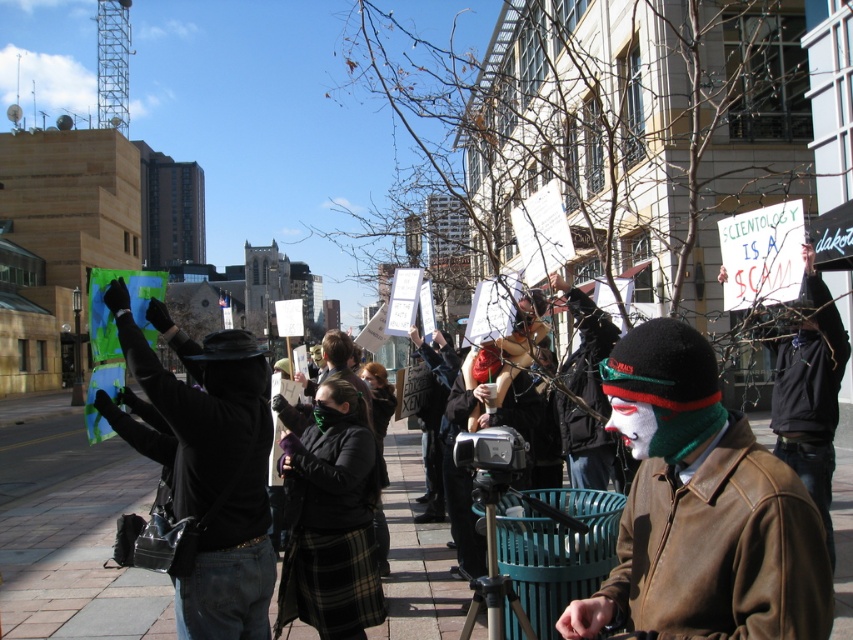
Based on the photo, you are a photographer trying to capture a clear shot of both the brown leather jacket at center and the black leather jacket at center in the protest scene. Which jacket should you focus on first to ensure it doesn t get blocked by the other?

The brown leather jacket at center has a lesser height compared to the black leather jacket at center. Therefore, you should focus on the brown leather jacket at center first to prevent it from being blocked by the taller black leather jacket at center.

You are a photographer at the protest scene. You want to take a picture of the protesters holding signs. The protesters are at the center of the image. There is a brown leather jacket at center represented by point (701, 509). Where should you position your camera to ensure the protesters and their signs are clearly visible in the photo?

The brown leather jacket at center is located at point (701, 509), which indicates the center of the image. To capture the protesters and their signs clearly, position the camera so that the center of the frame aligns with this point, ensuring the protesters at the center are in focus and visible.